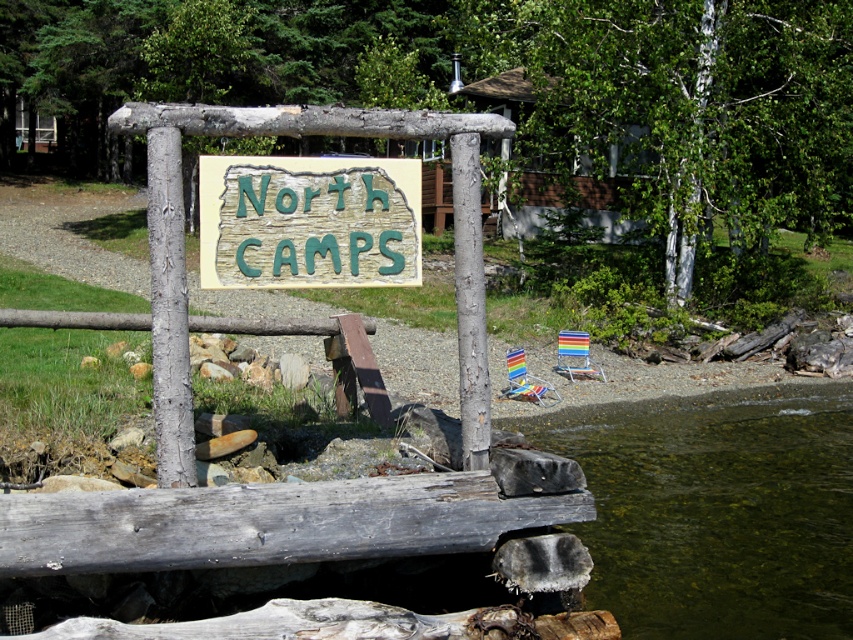
You are setting up a campsite and need to place a tent. The tent requires a space that is wider than the white smooth pole at center. Can the green carved wood sign at center provide enough space for the tent? Please explain.

The green carved wood sign at center has a width that surpasses the white smooth pole at center, so yes, the green carved wood sign at center provides enough space for the tent since its width is greater than the required width of the white smooth pole at center.

You are standing at the campsite and want to walk from the wooden signpost to the water. There are two points marked on the path. Which point should you step on first, point (164, 260) or point (463, 394)?

You should step on point (164, 260) first because it is in front of point (463, 394) along the path from the wooden signpost to the water.